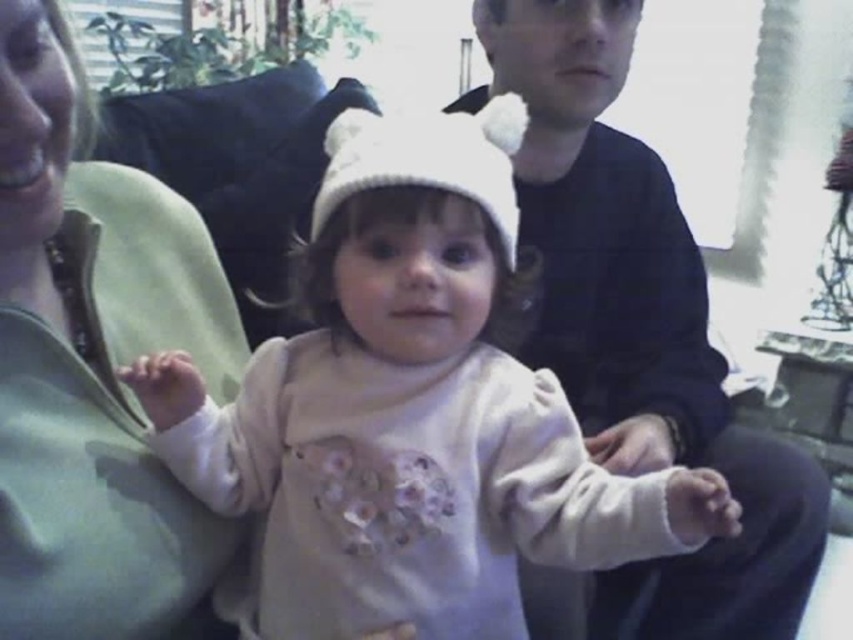
Is point (86, 557) closer to viewer compared to point (492, 157)?

That is True.

Does matte green pillow at left appear on the left side of white knit hat at center?

Indeed, matte green pillow at left is positioned on the left side of white knit hat at center.

Where is `matte green pillow at left`? The image size is (853, 640). matte green pillow at left is located at coordinates (94, 369).

Can you confirm if white soft hat at center is thinner than white knit hat at center?

Incorrect, white soft hat at center's width is not less than white knit hat at center's.

Can you confirm if white soft hat at center is wider than white knit hat at center?

Yes.

What do you see at coordinates (410, 410) in the screenshot? The image size is (853, 640). I see `white soft hat at center` at bounding box center [410, 410].

The height and width of the screenshot is (640, 853). Identify the location of white soft hat at center. (410, 410).

Is point (534, 68) positioned after point (444, 189)?

Yes, point (534, 68) is farther from viewer.

Looking at this image, who is shorter, dark blue sweater at center or white knit hat at center?

white knit hat at center

I want to click on dark blue sweater at center, so click(640, 330).